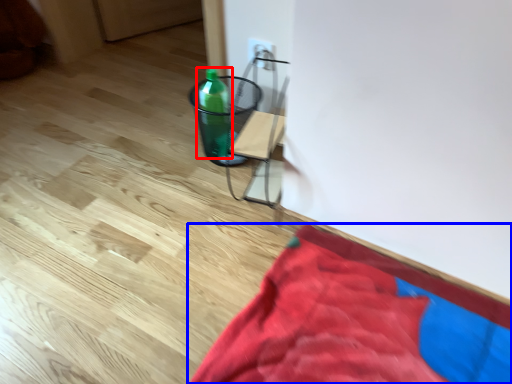
Question: Which point is further to the camera, bottle (highlighted by a red box) or blanket (highlighted by a blue box)?

Choices:
 (A) bottle
 (B) blanket

Answer: (A)